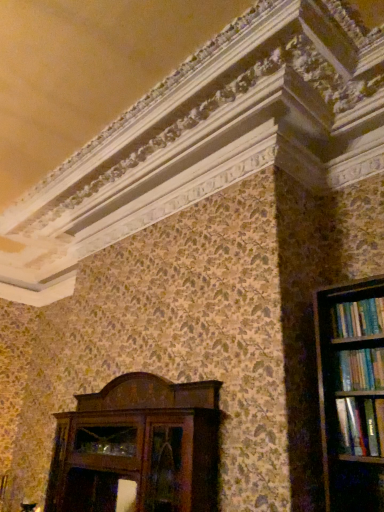
The height and width of the screenshot is (512, 384). What do you see at coordinates (361, 426) in the screenshot? I see `hardcover book at right` at bounding box center [361, 426].

The height and width of the screenshot is (512, 384). I want to click on hardcover book at right, so click(x=361, y=426).

Identify the location of hardcover book at right. This screenshot has width=384, height=512. [361, 426].